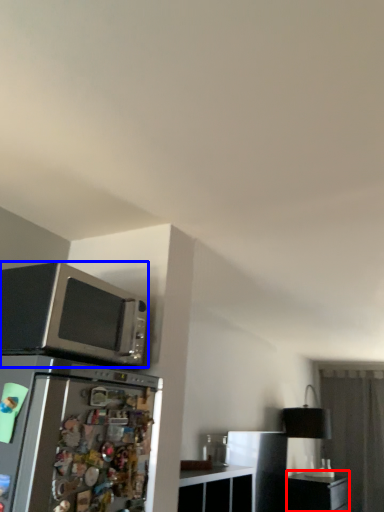
Question: Which object appears closest to the camera in this image, file cabinet (highlighted by a red box) or microwave oven (highlighted by a blue box)?

Choices:
 (A) file cabinet
 (B) microwave oven

Answer: (B)